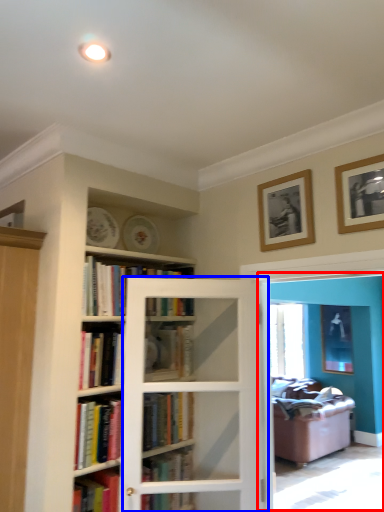
Question: Among these objects, which one is farthest to the camera, screen door (highlighted by a red box) or screen door (highlighted by a blue box)?

Choices:
 (A) screen door
 (B) screen door

Answer: (B)